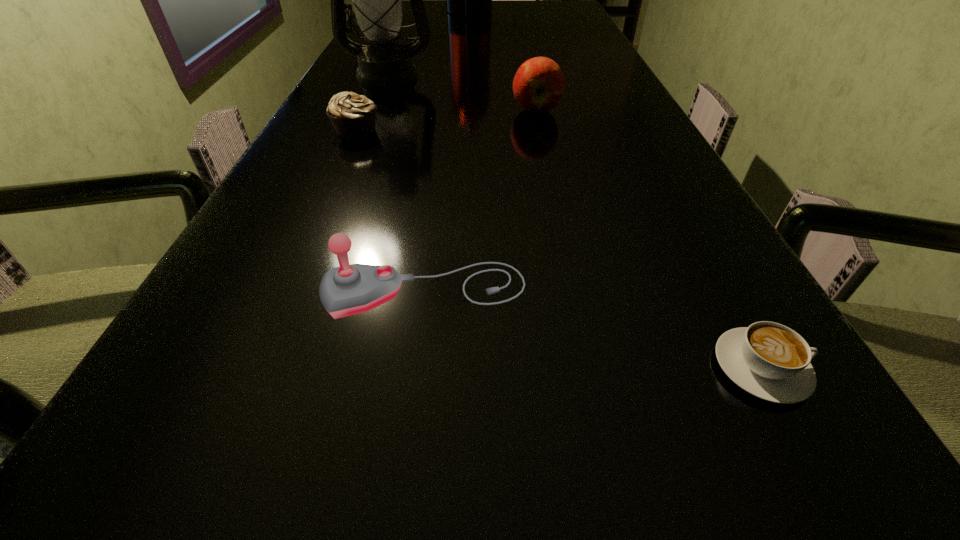
The width and height of the screenshot is (960, 540). Identify the location of vacant area located on the back of the second tallest object. (398, 48).

The width and height of the screenshot is (960, 540). I want to click on free region located 0.070m on the right of the fifth object from left to right, so click(x=590, y=110).

In order to click on vacant space located on the back of the joystick in this screenshot , I will do `click(432, 237)`.

Locate an element on the screen. This screenshot has height=540, width=960. blank area located on the back of the muffin is located at coordinates (378, 80).

This screenshot has height=540, width=960. Identify the location of object situated at the far edge. (463, 0).

Where is `oil lamp that is at the left edge`? The width and height of the screenshot is (960, 540). oil lamp that is at the left edge is located at coordinates (377, 3).

Locate an element on the screen. joystick located at the left edge is located at coordinates coord(349,289).

The width and height of the screenshot is (960, 540). I want to click on muffin that is at the left edge, so (x=353, y=116).

Locate an element on the screen. object that is at the right edge is located at coordinates (771, 361).

Where is `free location at the far edge of the desktop`? This screenshot has width=960, height=540. free location at the far edge of the desktop is located at coordinates (534, 9).